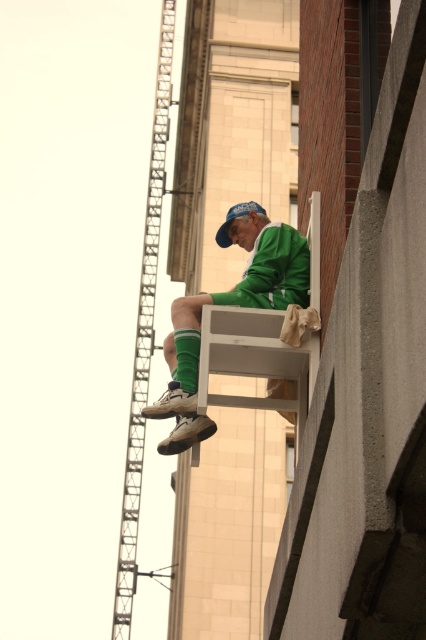
Can you confirm if green matte jacket at center is positioned below blue fabric cap at center?

Yes, green matte jacket at center is below blue fabric cap at center.

Is point (299, 237) farther from camera compared to point (218, 236)?

No, (299, 237) is in front of (218, 236).

Does point (196, 349) come behind point (244, 209)?

No, it is not.

The height and width of the screenshot is (640, 426). In order to click on green matte jacket at center in this screenshot , I will do `click(229, 305)`.